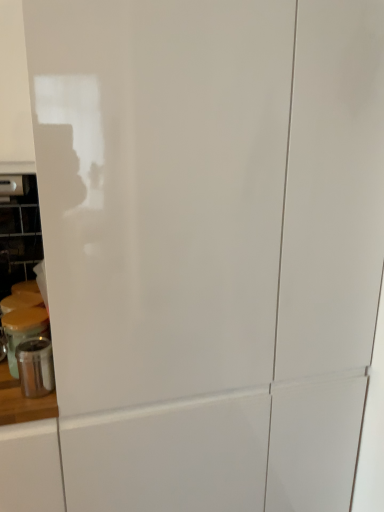
Question: Considering the positions of point (49, 385) and point (8, 350), is point (49, 385) closer or farther from the camera than point (8, 350)?

Choices:
 (A) farther
 (B) closer

Answer: (B)

Question: Based on their sizes in the image, would you say metallic silver canister at left, positioned as the second appliance in back-to-front order, is bigger or smaller than metallic silver canister at lower left, acting as the second appliance starting from the front?

Choices:
 (A) big
 (B) small

Answer: (B)

Question: Choose the correct answer: Is metallic silver canister at left, positioned as the second appliance in back-to-front order, inside metallic silver canister at lower left, acting as the second appliance starting from the front, or outside it?

Choices:
 (A) outside
 (B) inside

Answer: (A)

Question: Is point (x=18, y=331) positioned closer to the camera than point (x=46, y=390)?

Choices:
 (A) farther
 (B) closer

Answer: (A)

Question: Which is correct: metallic silver canister at lower left, acting as the second appliance starting from the front, is inside metallic silver canister at left, positioned as the second appliance in back-to-front order, or outside of it?

Choices:
 (A) outside
 (B) inside

Answer: (A)

Question: From their relative heights in the image, would you say metallic silver canister at lower left, acting as the second appliance starting from the front, is taller or shorter than metallic silver canister at left, positioned as the second appliance in back-to-front order?

Choices:
 (A) short
 (B) tall

Answer: (B)

Question: Is metallic silver canister at lower left, acting as the second appliance starting from the front, bigger or smaller than metallic silver canister at left, positioned as the second appliance in back-to-front order?

Choices:
 (A) small
 (B) big

Answer: (B)